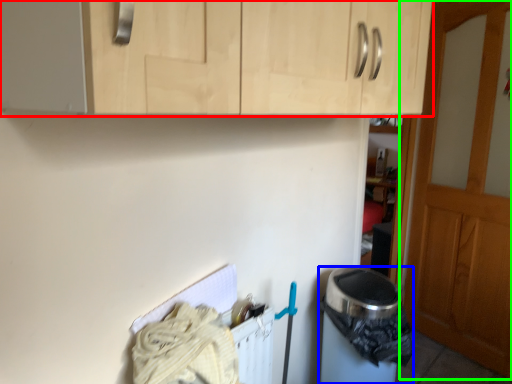
Question: Which is farther away from cabinetry (highlighted by a red box)? appliance (highlighted by a blue box) or door (highlighted by a green box)?

Choices:
 (A) appliance
 (B) door

Answer: (B)